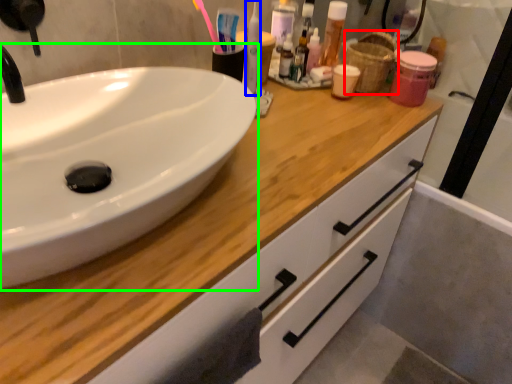
Question: Estimate the real-world distances between objects in this image. Which object is closer to basket (highlighted by a red box), mouthwash (highlighted by a blue box) or sink (highlighted by a green box)?

Choices:
 (A) mouthwash
 (B) sink

Answer: (A)